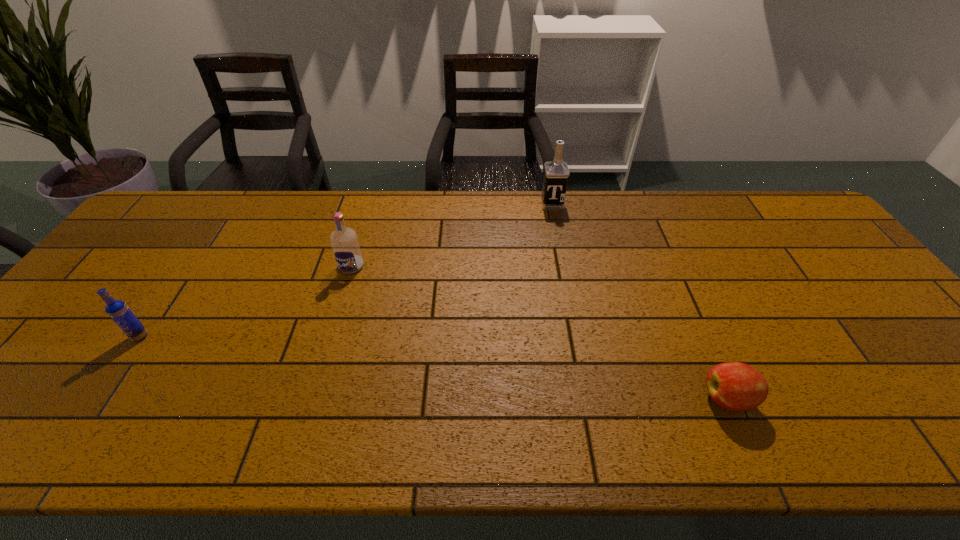
At what (x,y) coordinates should I click in order to perform the action: click on vacant area between the farthest object and the shortest object. Please return your answer as a coordinate pair (x, y). Image resolution: width=960 pixels, height=540 pixels. Looking at the image, I should click on tap(640, 301).

The height and width of the screenshot is (540, 960). I want to click on free space between the leftmost vodka and the shortest object, so click(x=434, y=368).

At what (x,y) coordinates should I click in order to perform the action: click on free point between the rightmost vodka and the second vodka from left to right. Please return your answer as a coordinate pair (x, y). Looking at the image, I should click on (451, 235).

Identify the location of vacant area between the third farthest object and the second vodka from right to left. The width and height of the screenshot is (960, 540). (246, 301).

Find the location of a particular element. This screenshot has width=960, height=540. empty space that is in between the rightmost object and the tallest object is located at coordinates pyautogui.click(x=640, y=301).

The width and height of the screenshot is (960, 540). I want to click on free space that is in between the farthest vodka and the apple, so click(640, 301).

This screenshot has height=540, width=960. In order to click on vacant point located between the tallest object and the second farthest object in this screenshot , I will do 451,235.

You are a GUI agent. You are given a task and a screenshot of the screen. Output one action in this format:
    pyautogui.click(x=<x>, y=<y>)
    Task: Click on the object identified as the third closest to the leftmost vodka
    Image resolution: width=960 pixels, height=540 pixels.
    Given the screenshot: What is the action you would take?
    pyautogui.click(x=735, y=386)

Identify which object is the closest to the leftmost vodka. Please provide its 2D coordinates. Your answer should be formatted as a tuple, i.e. [(x, y)], where the tuple contains the x and y coordinates of a point satisfying the conditions above.

[(344, 241)]

Identify which vodka is the closest to the leftmost vodka. Please provide its 2D coordinates. Your answer should be formatted as a tuple, i.e. [(x, y)], where the tuple contains the x and y coordinates of a point satisfying the conditions above.

[(344, 241)]